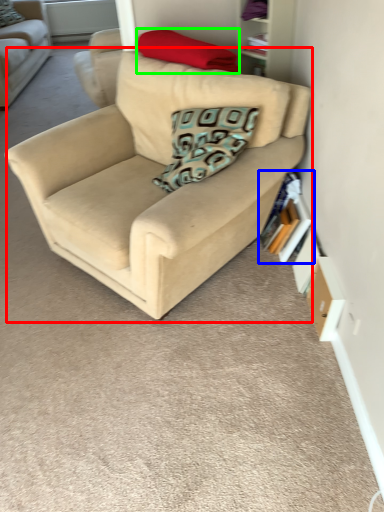
Question: Based on their relative distances, which object is farther from studio couch (highlighted by a red box)? Choose from book (highlighted by a blue box) and pillow (highlighted by a green box).

Choices:
 (A) book
 (B) pillow

Answer: (B)